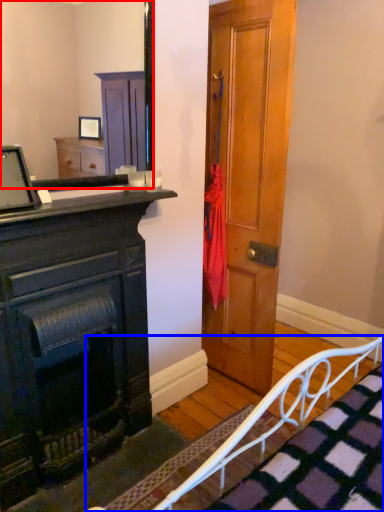
Question: Among these objects, which one is nearest to the camera, mirror (highlighted by a red box) or bed frame (highlighted by a blue box)?

Choices:
 (A) mirror
 (B) bed frame

Answer: (B)